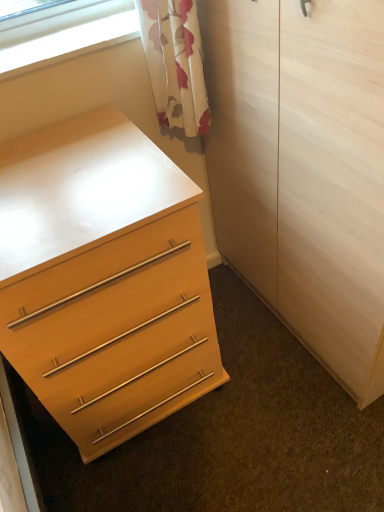
What do you see at coordinates (303, 169) in the screenshot? Image resolution: width=384 pixels, height=512 pixels. I see `light wood/texture armoire at center` at bounding box center [303, 169].

The height and width of the screenshot is (512, 384). What do you see at coordinates (104, 279) in the screenshot?
I see `matte wood chest of drawers at lower left` at bounding box center [104, 279].

Describe the element at coordinates (73, 38) in the screenshot. I see `clear glass window at upper left` at that location.

Where is `light wood/texture armoire at center`? The width and height of the screenshot is (384, 512). light wood/texture armoire at center is located at coordinates (303, 169).

Can you confirm if matte wood chest of drawers at lower left is bigger than clear glass window at upper left?

Yes, matte wood chest of drawers at lower left is bigger than clear glass window at upper left.

Considering the sizes of objects matte wood chest of drawers at lower left and clear glass window at upper left in the image provided, who is wider, matte wood chest of drawers at lower left or clear glass window at upper left?

With larger width is matte wood chest of drawers at lower left.

Which object is closer to the camera taking this photo, matte wood chest of drawers at lower left or clear glass window at upper left?

matte wood chest of drawers at lower left is closer to the camera.

In terms of width, does light wood/texture armoire at center look wider or thinner when compared to matte wood chest of drawers at lower left?

light wood/texture armoire at center is thinner than matte wood chest of drawers at lower left.

Is point (219, 151) closer to viewer compared to point (86, 298)?

That is False.

Is light wood/texture armoire at center shorter than matte wood chest of drawers at lower left?

No.

Between light wood/texture armoire at center and matte wood chest of drawers at lower left, which one appears on the left side from the viewer's perspective?

matte wood chest of drawers at lower left.

From the image's perspective, is matte wood chest of drawers at lower left located above or below light wood/texture armoire at center?

Based on their image positions, matte wood chest of drawers at lower left is located beneath light wood/texture armoire at center.

Considering the sizes of matte wood chest of drawers at lower left and light wood/texture armoire at center in the image, is matte wood chest of drawers at lower left bigger or smaller than light wood/texture armoire at center?

Considering their sizes, matte wood chest of drawers at lower left takes up less space than light wood/texture armoire at center.

Who is shorter, matte wood chest of drawers at lower left or light wood/texture armoire at center?

matte wood chest of drawers at lower left.

From a real-world perspective, does matte wood chest of drawers at lower left sit lower than light wood/texture armoire at center?

Yes.

Can you confirm if clear glass window at upper left is smaller than matte wood chest of drawers at lower left?

Yes.

Could you tell me if clear glass window at upper left is turned towards matte wood chest of drawers at lower left?

No, clear glass window at upper left is not turned towards matte wood chest of drawers at lower left.

Considering the relative sizes of clear glass window at upper left and matte wood chest of drawers at lower left in the image provided, is clear glass window at upper left wider than matte wood chest of drawers at lower left?

In fact, clear glass window at upper left might be narrower than matte wood chest of drawers at lower left.

Which is closer to the camera, [105,22] or [45,208]?

Clearly, point [105,22] is more distant from the camera than point [45,208].

Can you confirm if light wood/texture armoire at center is bigger than clear glass window at upper left?

Correct, light wood/texture armoire at center is larger in size than clear glass window at upper left.

Considering the relative sizes of light wood/texture armoire at center and clear glass window at upper left in the image provided, is light wood/texture armoire at center taller than clear glass window at upper left?

Yes, light wood/texture armoire at center is taller than clear glass window at upper left.

How much distance is there between clear glass window at upper left and light wood/texture armoire at center?

They are 20.35 inches apart.

Is point (25, 45) less distant than point (373, 142)?

That is False.

Identify the location of armoire lying in front of the clear glass window at upper left. (303, 169).

Is light wood/texture armoire at center completely or partially inside clear glass window at upper left?

No, light wood/texture armoire at center is not inside clear glass window at upper left.

Find the location of a particular element. the chest of drawers that appears below the clear glass window at upper left (from a real-world perspective) is located at coordinates (x=104, y=279).

The image size is (384, 512). Find the location of `chest of drawers on the left of light wood/texture armoire at center`. chest of drawers on the left of light wood/texture armoire at center is located at coordinates (104, 279).

When comparing their distances from light wood/texture armoire at center, does clear glass window at upper left or matte wood chest of drawers at lower left seem further?

Among the two, clear glass window at upper left is located further to light wood/texture armoire at center.

Based on their spatial positions, is light wood/texture armoire at center or clear glass window at upper left further from matte wood chest of drawers at lower left?

clear glass window at upper left.

Based on their spatial positions, is matte wood chest of drawers at lower left or clear glass window at upper left further from light wood/texture armoire at center?

clear glass window at upper left.

Looking at the image, which one is located closer to clear glass window at upper left, matte wood chest of drawers at lower left or light wood/texture armoire at center?

Among the two, matte wood chest of drawers at lower left is located nearer to clear glass window at upper left.

Based on their spatial positions, is light wood/texture armoire at center or matte wood chest of drawers at lower left further from clear glass window at upper left?

Among the two, light wood/texture armoire at center is located further to clear glass window at upper left.

Which object lies further to the anchor point matte wood chest of drawers at lower left, clear glass window at upper left or light wood/texture armoire at center?

Based on the image, clear glass window at upper left appears to be further to matte wood chest of drawers at lower left.

Find the location of `chest of drawers between clear glass window at upper left and light wood/texture armoire at center`. chest of drawers between clear glass window at upper left and light wood/texture armoire at center is located at coordinates (104, 279).